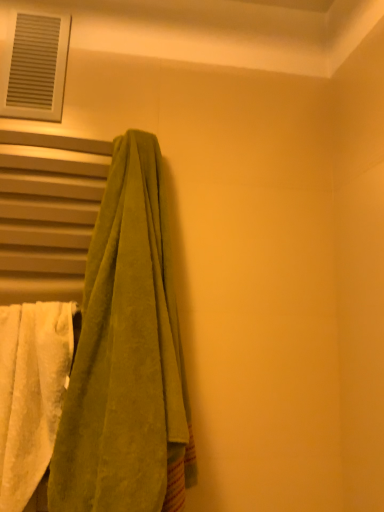
Question: In the image, is white plastic vent at upper left positioned in front of or behind white fluffy towel at left, which is the second towel from right to left?

Choices:
 (A) front
 (B) behind

Answer: (B)

Question: Is point (39, 105) closer or farther from the camera than point (39, 352)?

Choices:
 (A) closer
 (B) farther

Answer: (B)

Question: Based on their relative distances, which object is farther from the white plastic vent at upper left?

Choices:
 (A) white fluffy towel at left, which is the second towel from right to left
 (B) green velvety towel at left, the 1th towel in the right-to-left sequence

Answer: (A)

Question: Which object is positioned farthest from the green velvety towel at left, which is counted as the 2th towel, starting from the left?

Choices:
 (A) white fluffy towel at left, placed as the 1th towel when sorted from left to right
 (B) white plastic vent at upper left

Answer: (B)